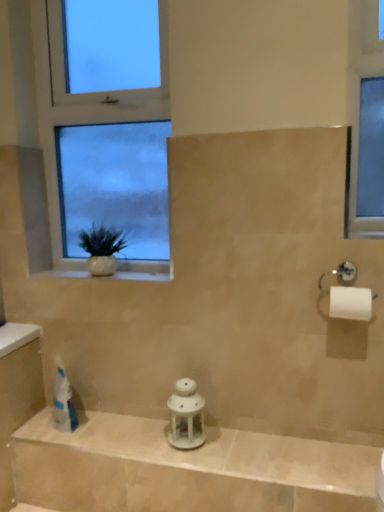
The width and height of the screenshot is (384, 512). I want to click on vacant location below white ceramic vase at left (from a real-world perspective), so click(x=119, y=275).